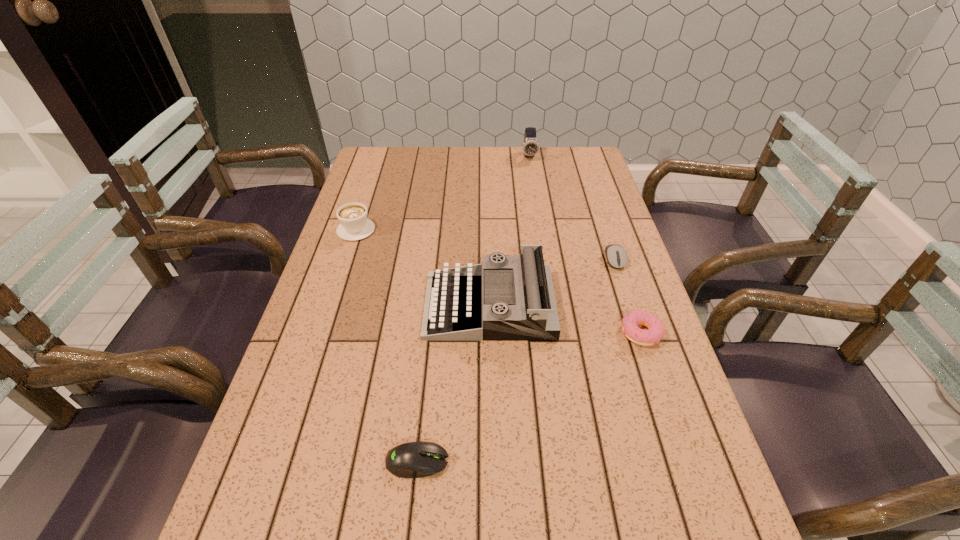
The height and width of the screenshot is (540, 960). I want to click on watch, so click(x=530, y=147).

The width and height of the screenshot is (960, 540). Identify the location of typewriter. (456, 308).

You are a GUI agent. You are given a task and a screenshot of the screen. Output one action in this format:
    pyautogui.click(x=<x>, y=<y>)
    Task: Click on the fourth shortest object
    This screenshot has height=540, width=960.
    Given the screenshot: What is the action you would take?
    pyautogui.click(x=354, y=225)

The width and height of the screenshot is (960, 540). What are the coordinates of `cappuccino` in the screenshot? It's located at (354, 225).

This screenshot has width=960, height=540. I want to click on doughnut, so click(630, 322).

You are a GUI agent. You are given a task and a screenshot of the screen. Output one action in this format:
    pyautogui.click(x=<x>, y=<y>)
    Task: Click on the farther computer mouse
    This screenshot has width=960, height=540.
    Given the screenshot: What is the action you would take?
    pyautogui.click(x=616, y=256)

You are a GUI agent. You are given a task and a screenshot of the screen. Output one action in this format:
    pyautogui.click(x=<x>, y=<y>)
    Task: Click on the right computer mouse
    
    Given the screenshot: What is the action you would take?
    pyautogui.click(x=616, y=256)

This screenshot has width=960, height=540. What are the coordinates of `the nearer computer mouse` in the screenshot? It's located at (418, 459).

Where is `the left computer mouse`? This screenshot has height=540, width=960. the left computer mouse is located at coordinates (418, 459).

Locate an element on the screen. The height and width of the screenshot is (540, 960). free space located on the face of the farthest object is located at coordinates (532, 176).